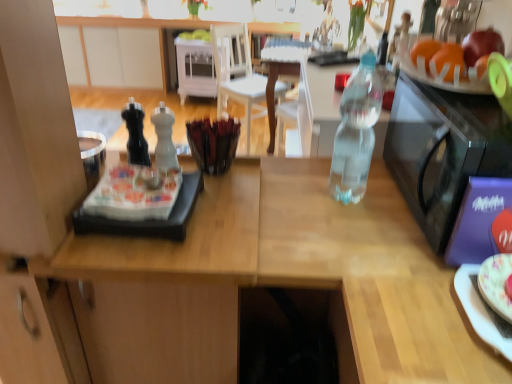
Where is `vacant region to the left of porcelain floral plate at right`? The height and width of the screenshot is (384, 512). vacant region to the left of porcelain floral plate at right is located at coordinates (411, 304).